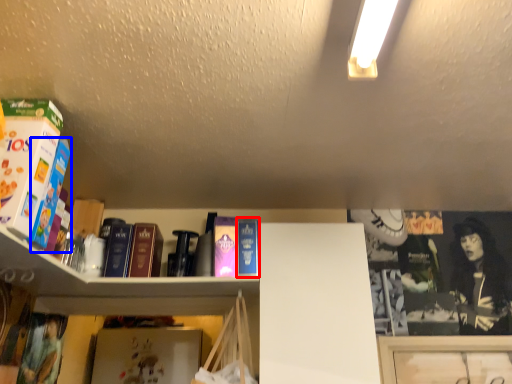
Question: Which of the following is the farthest to the observer, paperback book (highlighted by a red box) or book (highlighted by a blue box)?

Choices:
 (A) paperback book
 (B) book

Answer: (A)